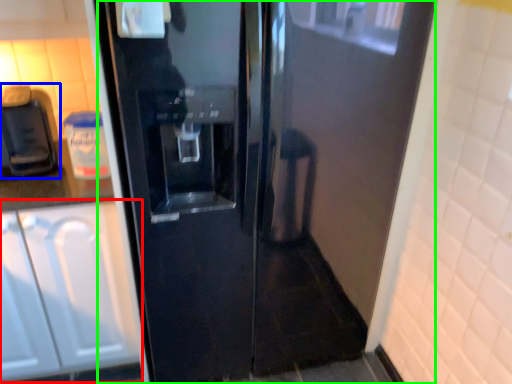
Question: Based on their relative distances, which object is nearer to cabinetry (highlighted by a red box)? Choose from coffee machine (highlighted by a blue box) and door (highlighted by a green box).

Choices:
 (A) coffee machine
 (B) door

Answer: (A)